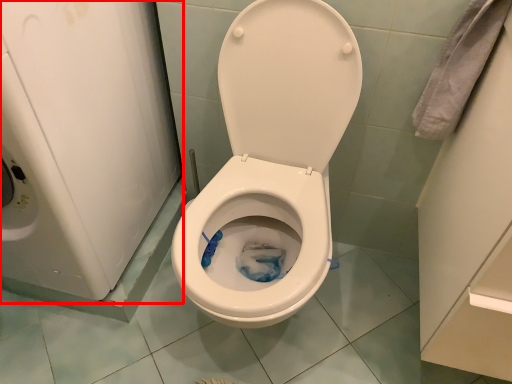
Question: Where is appliance (annotated by the red box) located in relation to toilet in the image?

Choices:
 (A) left
 (B) right

Answer: (A)